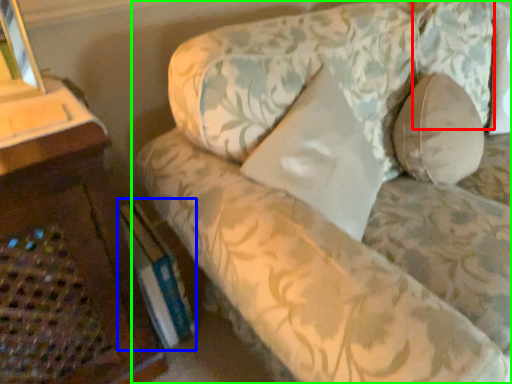
Question: Which object is the farthest from pillow (highlighted by a red box)? Choose among these: paperback book (highlighted by a blue box) or studio couch (highlighted by a green box).

Choices:
 (A) paperback book
 (B) studio couch

Answer: (A)